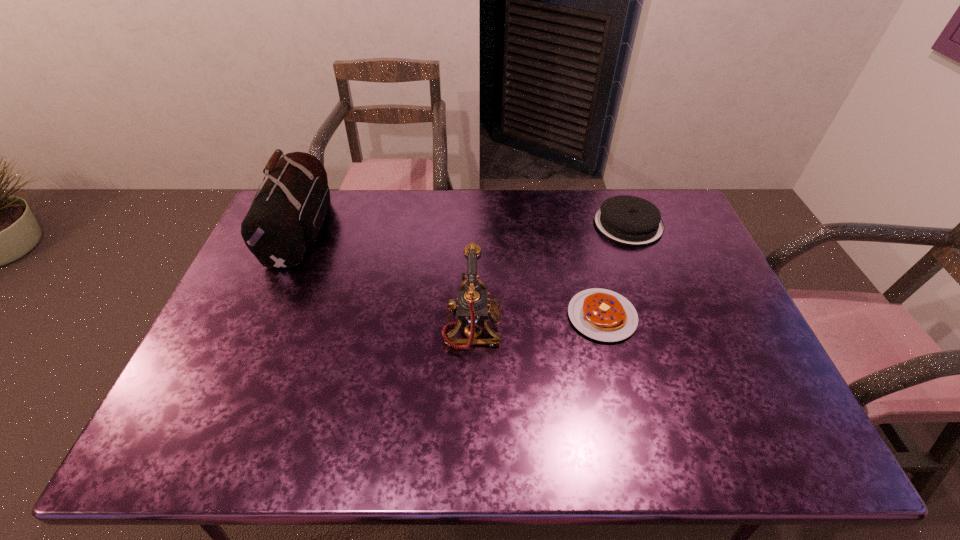
At what (x,y) coordinates should I click in order to perform the action: click on blank region between the telephone and the duffel bag. Please return your answer as a coordinate pair (x, y). The width and height of the screenshot is (960, 540). Looking at the image, I should click on (387, 279).

Where is `free space between the second tallest object and the duffel bag`? The image size is (960, 540). free space between the second tallest object and the duffel bag is located at coordinates (387, 279).

Locate an element on the screen. The width and height of the screenshot is (960, 540). vacant area that lies between the farther pancake and the nearer pancake is located at coordinates (615, 270).

Locate an element on the screen. This screenshot has width=960, height=540. vacant point located between the shorter pancake and the telephone is located at coordinates (538, 322).

Where is `free space between the duffel bag and the taller pancake`? This screenshot has width=960, height=540. free space between the duffel bag and the taller pancake is located at coordinates (465, 227).

Locate an element on the screen. empty space between the taller pancake and the shorter pancake is located at coordinates (615, 270).

This screenshot has height=540, width=960. I want to click on vacant area that lies between the telephone and the taller pancake, so click(x=550, y=276).

You are a GUI agent. You are given a task and a screenshot of the screen. Output one action in this format:
    pyautogui.click(x=<x>, y=<y>)
    Task: Click on the unoccupied area between the shortest object and the second tallest object
    This screenshot has width=960, height=540.
    Given the screenshot: What is the action you would take?
    pyautogui.click(x=538, y=322)

Find the location of a particular element. This screenshot has width=960, height=540. vacant area that lies between the second shortest object and the leftmost object is located at coordinates (465, 227).

Image resolution: width=960 pixels, height=540 pixels. I want to click on vacant space that is in between the telephone and the leftmost object, so click(x=387, y=279).